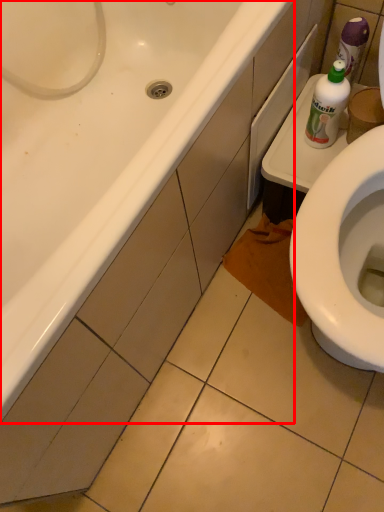
Question: From the image's perspective, where is bathtub (annotated by the red box) located in relation to bottle in the image?

Choices:
 (A) above
 (B) below

Answer: (B)